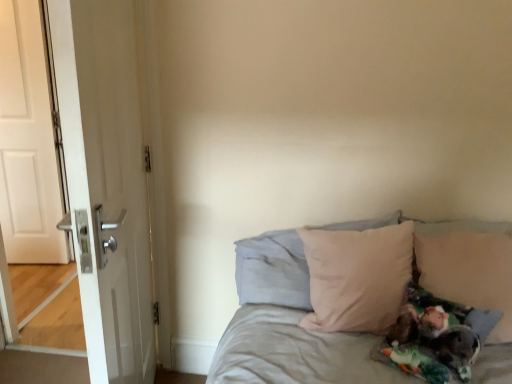
Question: Is beige fabric pillow at center, arranged as the 2th pillow when viewed from the right, taller or shorter than beige fabric pillow at right, the second pillow when ordered from left to right?

Choices:
 (A) tall
 (B) short

Answer: (A)

Question: From a real-world perspective, relative to beige fabric pillow at right, the second pillow when ordered from left to right, is beige fabric pillow at center, the 1th pillow in the left-to-right sequence, vertically above or below?

Choices:
 (A) above
 (B) below

Answer: (B)

Question: Which object is the closest to the beige fabric bed at center?

Choices:
 (A) beige fabric pillow at right, the second pillow when ordered from left to right
 (B) beige fabric pillow at center, the 1th pillow in the left-to-right sequence
 (C) white glossy door at left, the 1th door viewed from the front
 (D) white matte door at left, the second door from the right

Answer: (B)

Question: Estimate the real-world distances between objects in this image. Which object is closer to the white glossy door at left, the 1th door viewed from the front?

Choices:
 (A) beige fabric pillow at center, the 1th pillow in the left-to-right sequence
 (B) beige fabric bed at center
 (C) beige fabric pillow at right, arranged as the 1th pillow when viewed from the right
 (D) white matte door at left, the first door positioned from the back

Answer: (A)